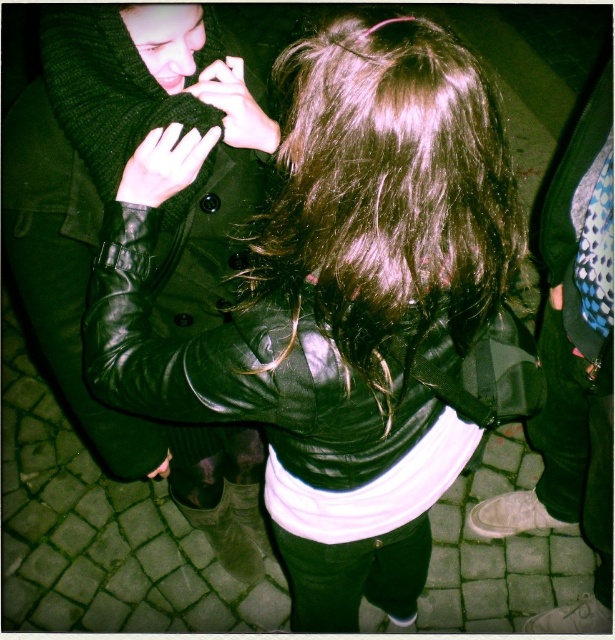
Looking at this image, does leather jacket at center appear under matte black hand at lower left?

No.

Who is shorter, leather jacket at center or matte black hand at lower left?

With less height is matte black hand at lower left.

Where is `leather jacket at center`? leather jacket at center is located at coordinates click(x=347, y=310).

Between point (295, 51) and point (161, 467), which one is positioned behind?

The point (161, 467) is more distant.

Who is taller, shiny brown hair at center or matte black hand at lower left?

shiny brown hair at center

Locate an element on the screen. shiny brown hair at center is located at coordinates (389, 204).

Is shiny brown hair at center below shiny black leather jacket at center?

No, shiny brown hair at center is not below shiny black leather jacket at center.

Describe the element at coordinates (389, 204) in the screenshot. I see `shiny brown hair at center` at that location.

Where is `shiny brown hair at center`? The height and width of the screenshot is (640, 615). shiny brown hair at center is located at coordinates (389, 204).